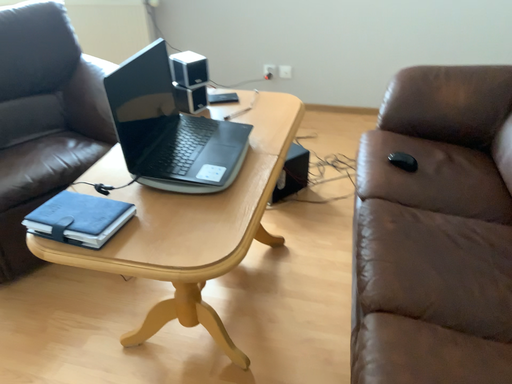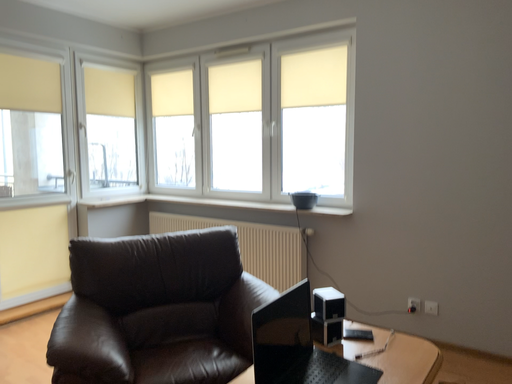
Question: Which way did the camera rotate in the video?

Choices:
 (A) rotated upward
 (B) rotated downward

Answer: (A)